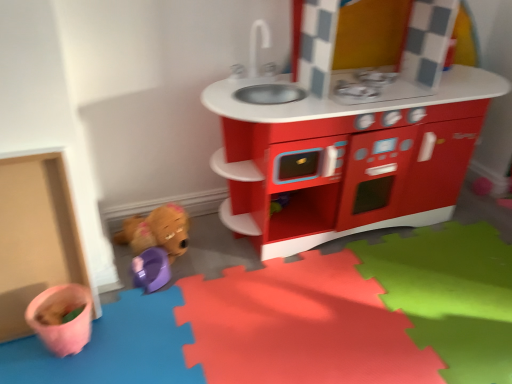
Where is `vacant area that is situated to the right of purple plastic toy at lower left, which ranks as the first toy in bottom-to-top order`? vacant area that is situated to the right of purple plastic toy at lower left, which ranks as the first toy in bottom-to-top order is located at coordinates (204, 280).